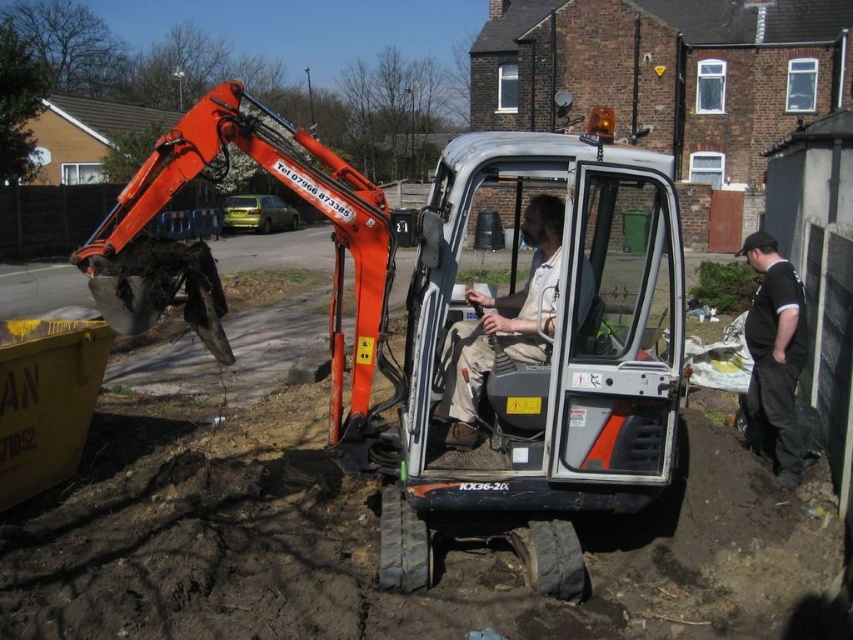
You are a safety inspector at the construction site. You notice two workers wearing camouflage fabric pants at center and black cotton shirt at right. According to safety protocols, workers must maintain a minimum distance of 5 feet apart to avoid accidents. Can you confirm if they are complying with the safety distance requirement?

The camouflage fabric pants at center is 7.12 feet away from black cotton shirt at right, which exceeds the required 5 feet distance. Therefore, they are complying with the safety distance requirement.

You are a safety inspector observing the construction site. You notice two workers wearing different clothing items. The camouflage fabric pants at center and the black cotton shirt at right. According to safety protocols, workers must wear their shirts tucked in. Which worker is more likely to be compliant with this rule?

The black cotton shirt at right is more likely to be compliant with the safety rule because it is positioned to the right of the camouflage fabric pants at center, implying the shirt is properly tucked in.

You are a safety inspector checking the clothing of workers at the construction site. You notice two workers wearing camouflage fabric pants at center and black cotton shirt at right. Which worker is wearing clothing with a larger size?

The camouflage fabric pants at center is bigger than the black cotton shirt at right, so the worker wearing camouflage fabric pants at center has clothing of larger size.